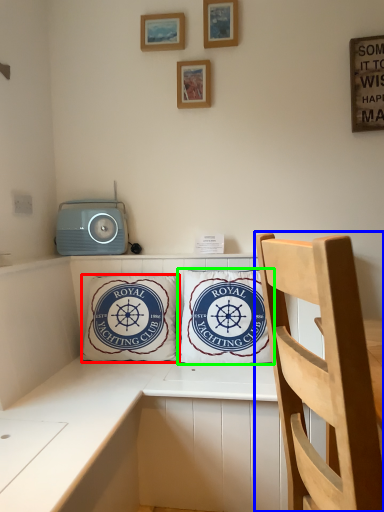
Question: Which object is the farthest from pillow (highlighted by a red box)? Choose among these: chair (highlighted by a blue box) or pillow (highlighted by a green box).

Choices:
 (A) chair
 (B) pillow

Answer: (A)